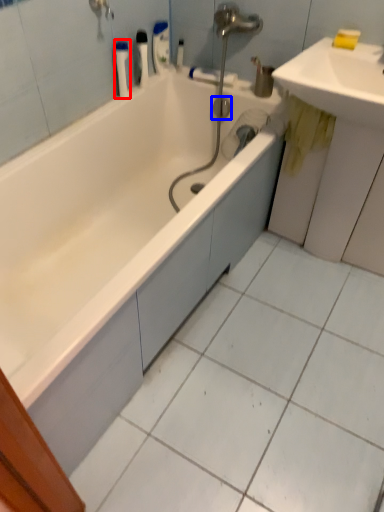
Question: Which object appears closest to the camera in this image, toiletry (highlighted by a red box) or plumbing fixture (highlighted by a blue box)?

Choices:
 (A) toiletry
 (B) plumbing fixture

Answer: (A)